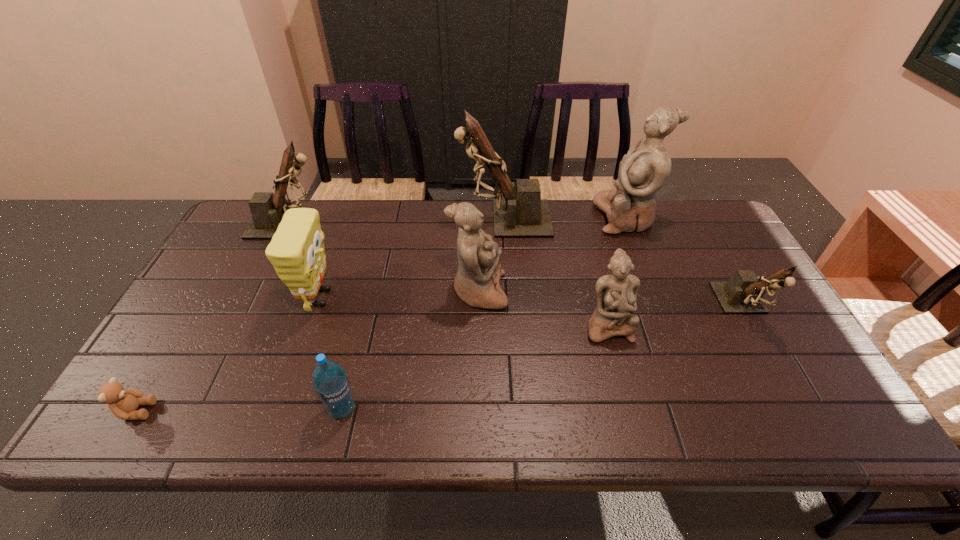
The image size is (960, 540). I want to click on object positioned at the right edge, so click(x=743, y=293).

Where is `object positioned at the far left corner`? object positioned at the far left corner is located at coordinates (267, 209).

I want to click on object that is at the near left corner, so click(x=123, y=403).

The image size is (960, 540). In the image, there is a desktop. In order to click on vacant region at the far edge in this screenshot , I will do `click(604, 244)`.

Find the location of a particular element. free location at the near edge is located at coordinates (341, 422).

Locate an element on the screen. Image resolution: width=960 pixels, height=540 pixels. free region at the left edge is located at coordinates (214, 298).

Where is `free spot at the right edge of the desktop`? The image size is (960, 540). free spot at the right edge of the desktop is located at coordinates (762, 385).

The image size is (960, 540). Find the location of `vacant space at the far right corner of the desktop`. vacant space at the far right corner of the desktop is located at coordinates (702, 221).

The height and width of the screenshot is (540, 960). In order to click on free space between the leftmost white figurine and the second shortest object in this screenshot , I will do `click(410, 350)`.

Where is `free spot between the leftmost figurine and the smallest white figurine`? The image size is (960, 540). free spot between the leftmost figurine and the smallest white figurine is located at coordinates (448, 275).